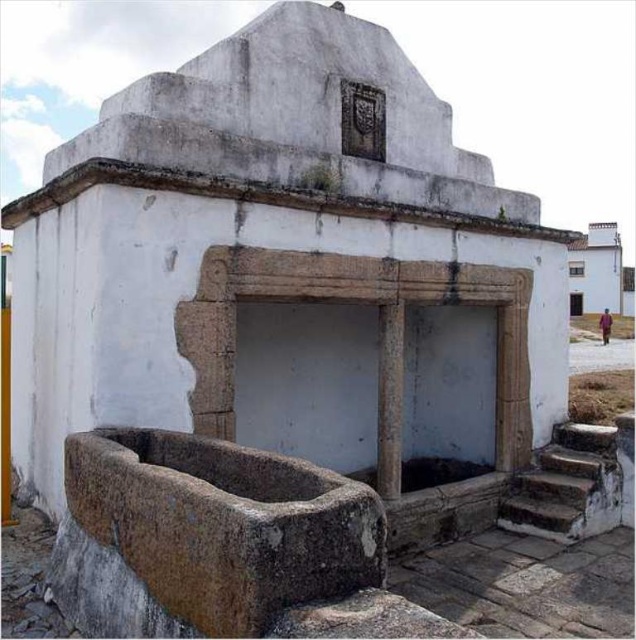
Is point (576, 492) positioned before point (377, 477)?

No, (576, 492) is further to viewer.

This screenshot has height=640, width=636. What do you see at coordinates (567, 486) in the screenshot? I see `rusty stone stairs at lower right` at bounding box center [567, 486].

Where is `rusty stone stairs at lower right`? rusty stone stairs at lower right is located at coordinates (567, 486).